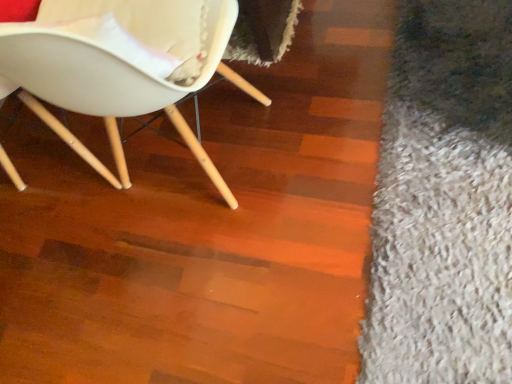
Measure the distance between point (229, 27) and camera.

The depth of point (229, 27) is 37.87 inches.

The height and width of the screenshot is (384, 512). I want to click on white matte plastic chair at upper left, so click(x=119, y=65).

In order to face white matte plastic chair at upper left, should I rotate leftwards or rightwards?

Rotate left and turn 14.941 degrees.

What do you see at coordinates (119, 65) in the screenshot? I see `white matte plastic chair at upper left` at bounding box center [119, 65].

Find the location of a particular element. white matte plastic chair at upper left is located at coordinates (119, 65).